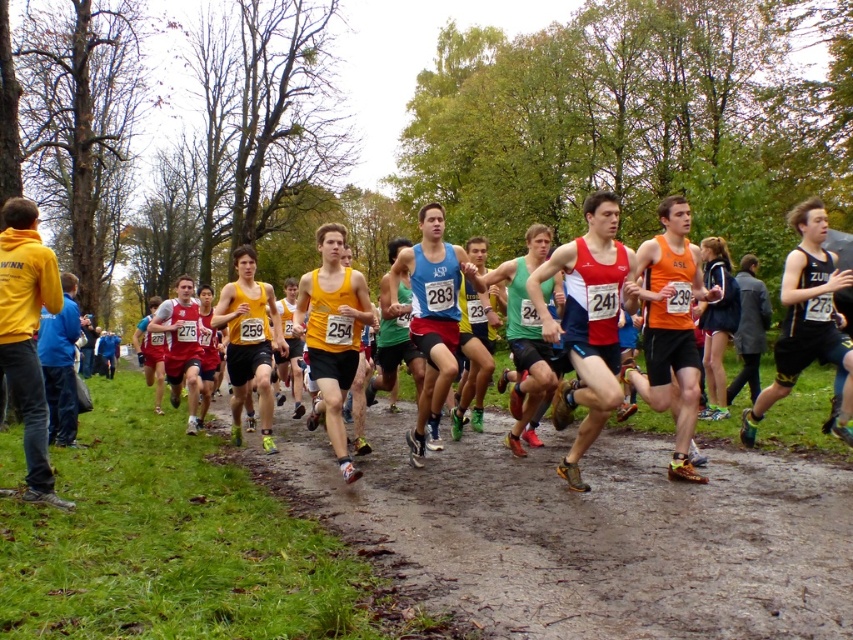
Question: Which object is the farthest from the blue fabric tank top at center?

Choices:
 (A) black jersey at center
 (B) matte red tank top at center
 (C) blue fabric jacket at left
 (D) yellow hoodie at left

Answer: (B)

Question: Can you confirm if black jersey at center is positioned above blue fabric jacket at left?

Choices:
 (A) no
 (B) yes

Answer: (B)

Question: Does yellow hoodie at left have a larger size compared to blue fabric jacket at left?

Choices:
 (A) no
 (B) yes

Answer: (B)

Question: Which object is closer to the camera taking this photo?

Choices:
 (A) black jersey at center
 (B) blue fabric tank top at center
 (C) matte red tank top at center
 (D) blue fabric jacket at left

Answer: (A)

Question: Which object is positioned closest to the blue fabric tank top at center?

Choices:
 (A) matte red tank top at center
 (B) blue fabric jacket at left
 (C) black jersey at center

Answer: (C)

Question: Does yellow hoodie at left have a greater width compared to blue fabric tank top at center?

Choices:
 (A) yes
 (B) no

Answer: (B)